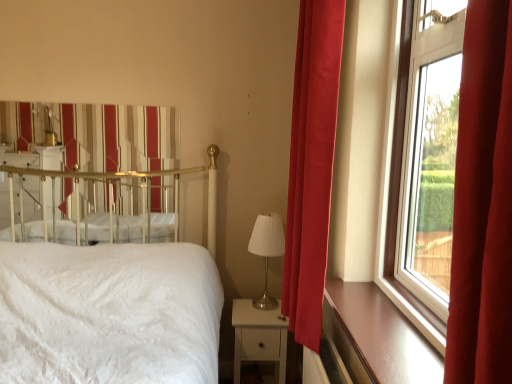
Question: Does metallic gold canopy bed at upper left lie in front of brown wood at right?

Choices:
 (A) yes
 (B) no

Answer: (B)

Question: From the image's perspective, does metallic gold canopy bed at upper left appear higher than brown wood at right?

Choices:
 (A) no
 (B) yes

Answer: (B)

Question: Are metallic gold canopy bed at upper left and brown wood at right located far from each other?

Choices:
 (A) no
 (B) yes

Answer: (B)

Question: Can you confirm if metallic gold canopy bed at upper left is wider than brown wood at right?

Choices:
 (A) no
 (B) yes

Answer: (A)

Question: Is metallic gold canopy bed at upper left shorter than brown wood at right?

Choices:
 (A) yes
 (B) no

Answer: (B)

Question: From the image's perspective, relative to white textured bed at left, is metallic gold canopy bed at upper left above or below?

Choices:
 (A) below
 (B) above

Answer: (B)

Question: Considering their positions, is metallic gold canopy bed at upper left located in front of or behind white textured bed at left?

Choices:
 (A) behind
 (B) front

Answer: (A)

Question: From their relative heights in the image, would you say metallic gold canopy bed at upper left is taller or shorter than white textured bed at left?

Choices:
 (A) tall
 (B) short

Answer: (B)

Question: Does point (135, 215) appear closer or farther from the camera than point (44, 380)?

Choices:
 (A) closer
 (B) farther

Answer: (B)

Question: In the image, is metallic gold canopy bed at upper left positioned in front of or behind silver metallic table lamp at center?

Choices:
 (A) behind
 (B) front

Answer: (A)

Question: Is point [x=152, y=238] closer or farther from the camera than point [x=261, y=231]?

Choices:
 (A) closer
 (B) farther

Answer: (B)

Question: Considering the relative positions of metallic gold canopy bed at upper left and silver metallic table lamp at center in the image provided, is metallic gold canopy bed at upper left to the left or to the right of silver metallic table lamp at center?

Choices:
 (A) left
 (B) right

Answer: (A)

Question: In terms of width, does metallic gold canopy bed at upper left look wider or thinner when compared to silver metallic table lamp at center?

Choices:
 (A) thin
 (B) wide

Answer: (A)

Question: From their relative heights in the image, would you say silver metallic table lamp at center is taller or shorter than white textured bed at left?

Choices:
 (A) tall
 (B) short

Answer: (B)

Question: Is silver metallic table lamp at center bigger or smaller than white textured bed at left?

Choices:
 (A) small
 (B) big

Answer: (A)